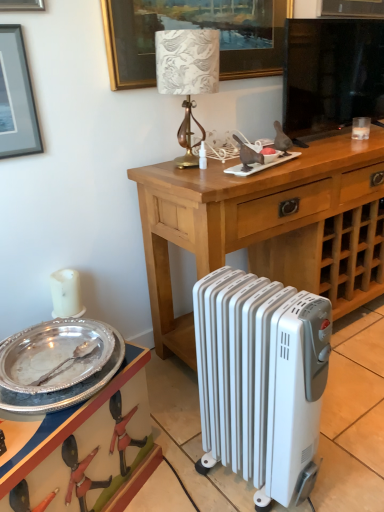
Question: Considering the relative sizes of wooden desk at center and black glass television at upper center in the image provided, is wooden desk at center shorter than black glass television at upper center?

Choices:
 (A) yes
 (B) no

Answer: (B)

Question: Does wooden desk at center come behind black glass television at upper center?

Choices:
 (A) no
 (B) yes

Answer: (A)

Question: Is wooden desk at center not near black glass television at upper center?

Choices:
 (A) yes
 (B) no

Answer: (B)

Question: Would you say wooden desk at center is outside black glass television at upper center?

Choices:
 (A) no
 (B) yes

Answer: (B)

Question: Does wooden desk at center appear on the right side of black glass television at upper center?

Choices:
 (A) no
 (B) yes

Answer: (B)

Question: Is wooden desk at center inside the boundaries of white metallic radiator at lower center, or outside?

Choices:
 (A) inside
 (B) outside

Answer: (B)

Question: Is wooden desk at center wider or thinner than white metallic radiator at lower center?

Choices:
 (A) wide
 (B) thin

Answer: (A)

Question: Considering the positions of wooden desk at center and white metallic radiator at lower center in the image, is wooden desk at center taller or shorter than white metallic radiator at lower center?

Choices:
 (A) tall
 (B) short

Answer: (A)

Question: From a real-world perspective, is wooden desk at center physically located above or below white metallic radiator at lower center?

Choices:
 (A) above
 (B) below

Answer: (A)

Question: From the image's perspective, is silver/glossy plate at lower left positioned above or below silver metallic tray at lower left?

Choices:
 (A) below
 (B) above

Answer: (B)

Question: Is silver/glossy plate at lower left to the left or to the right of silver metallic tray at lower left in the image?

Choices:
 (A) right
 (B) left

Answer: (A)

Question: Is silver/glossy plate at lower left situated inside silver metallic tray at lower left or outside?

Choices:
 (A) outside
 (B) inside

Answer: (A)

Question: From their relative heights in the image, would you say silver/glossy plate at lower left is taller or shorter than silver metallic tray at lower left?

Choices:
 (A) short
 (B) tall

Answer: (A)

Question: In terms of height, does black glass television at upper center look taller or shorter compared to gold metallic lampshade at center?

Choices:
 (A) tall
 (B) short

Answer: (A)

Question: Considering the positions of black glass television at upper center and gold metallic lampshade at center in the image, is black glass television at upper center wider or thinner than gold metallic lampshade at center?

Choices:
 (A) thin
 (B) wide

Answer: (A)